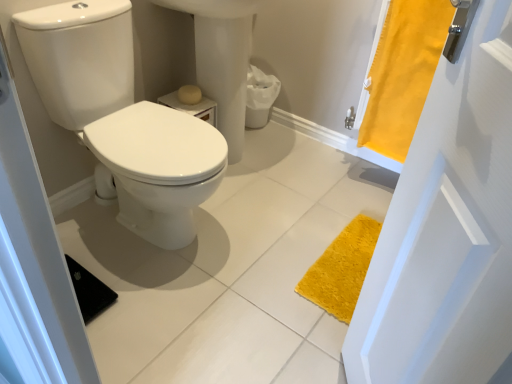
Locate an element on the screen. vacant area that is in front of white glossy toilet at left is located at coordinates (157, 310).